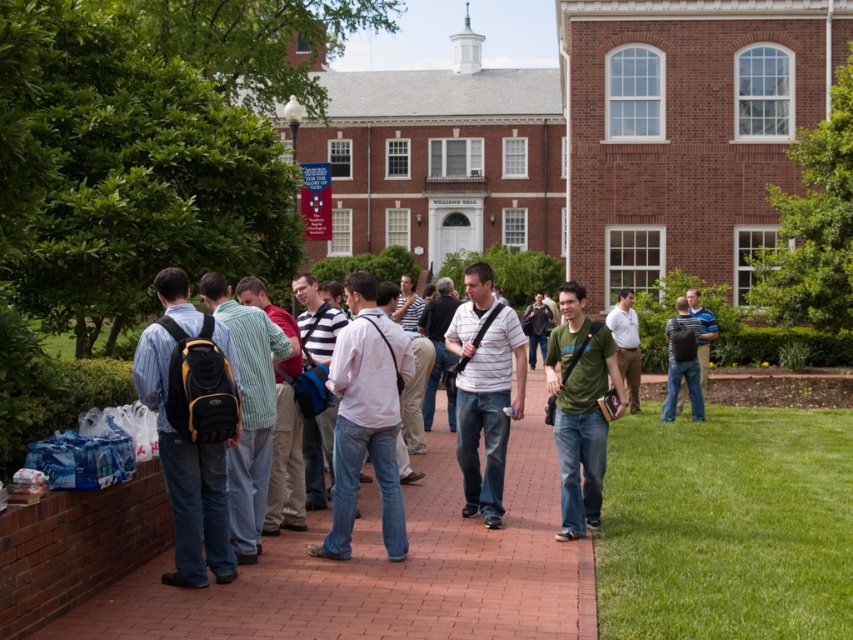
You are standing on the brick pavement at center and want to move to the green matte shirt at center. Which direction should you move to reach the shirt?

The brick pavement at center is positioned on the left side of the green matte shirt at center, so you should move to the right to reach the shirt.